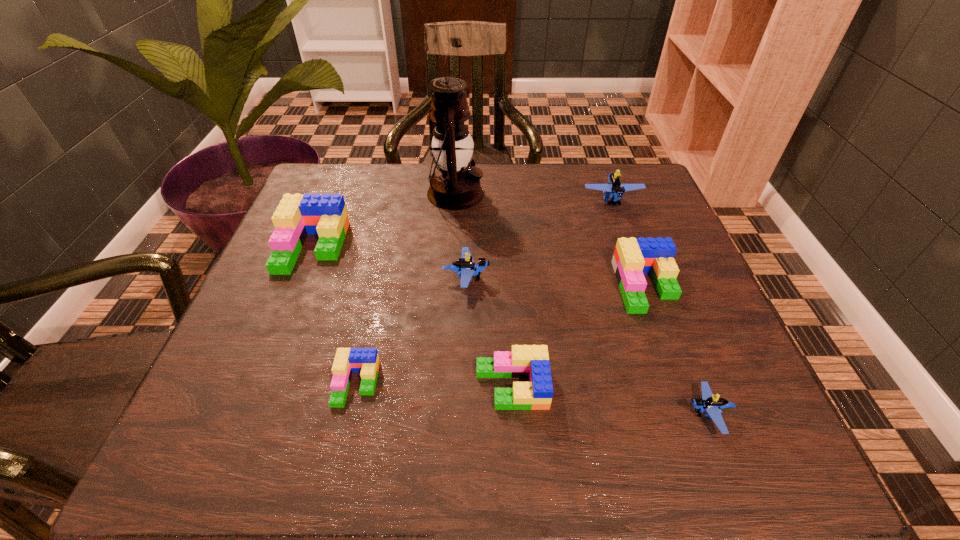
Identify the location of the nearest blue Lego. (712, 404).

Find the location of a particular element. This screenshot has height=540, width=960. the second object from left to right is located at coordinates (347, 360).

Where is `the shortest object`? the shortest object is located at coordinates (347, 360).

The image size is (960, 540). Find the location of `free space located on the side of the tallest object, there is a wick adjustment knob`. free space located on the side of the tallest object, there is a wick adjustment knob is located at coordinates (526, 193).

What are the coordinates of `vacant area situated 0.150m on the front-facing side of the farthest Lego` in the screenshot? It's located at (632, 256).

The width and height of the screenshot is (960, 540). I want to click on vacant space situated on the front of the leftmost object, so click(x=247, y=407).

The image size is (960, 540). In order to click on vacant space located 0.260m on the front-facing side of the second biggest blue Lego in this screenshot , I will do `click(612, 278)`.

The height and width of the screenshot is (540, 960). Find the location of `vacant space located 0.140m on the back of the rightmost green Lego`. vacant space located 0.140m on the back of the rightmost green Lego is located at coordinates (622, 222).

Locate an element on the screen. The height and width of the screenshot is (540, 960). vacant point located 0.160m on the back of the third green Lego from left to right is located at coordinates (507, 297).

This screenshot has width=960, height=540. Find the location of `vacant space located 0.090m on the front-facing side of the smallest blue Lego`. vacant space located 0.090m on the front-facing side of the smallest blue Lego is located at coordinates (630, 414).